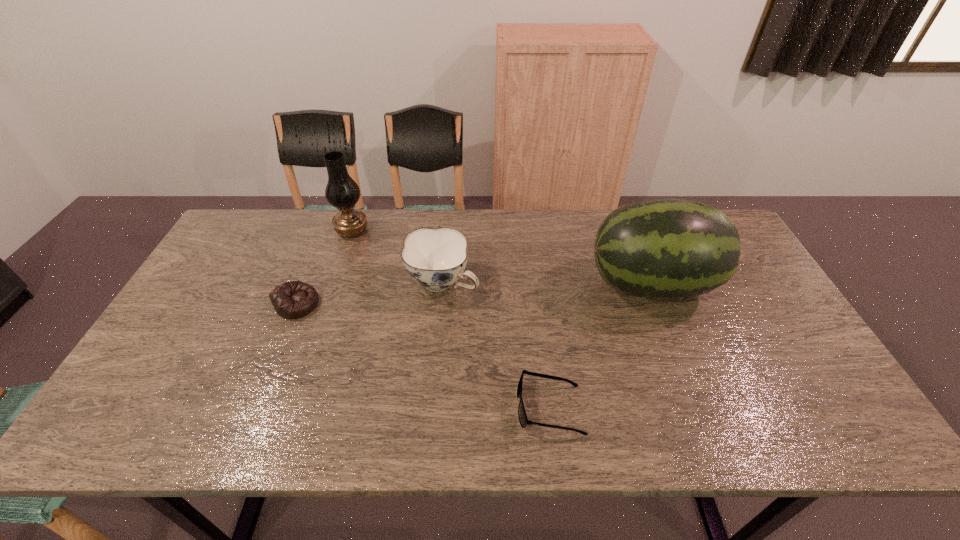
Find the location of a particular element. Image resolution: width=960 pixels, height=540 pixels. free spot between the third object from left to right and the rightmost object is located at coordinates (546, 284).

Locate an element on the screen. This screenshot has height=540, width=960. free space between the rightmost object and the sunglasses is located at coordinates (600, 346).

Select which object is the fourth closest to the rightmost object. Please provide its 2D coordinates. Your answer should be formatted as a tuple, i.e. [(x, y)], where the tuple contains the x and y coordinates of a point satisfying the conditions above.

[(293, 299)]

Choose which object is the third nearest neighbor to the oil lamp. Please provide its 2D coordinates. Your answer should be formatted as a tuple, i.e. [(x, y)], where the tuple contains the x and y coordinates of a point satisfying the conditions above.

[(663, 248)]